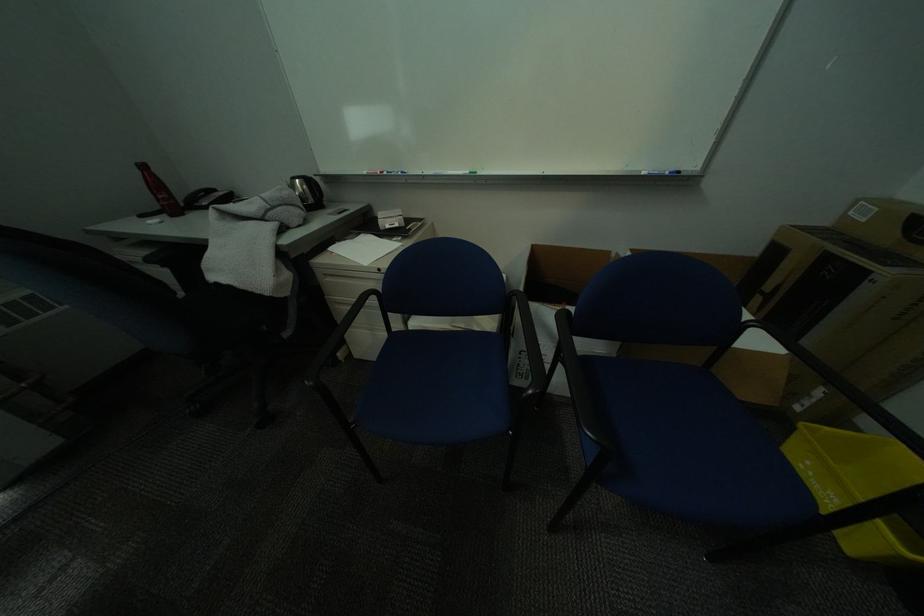
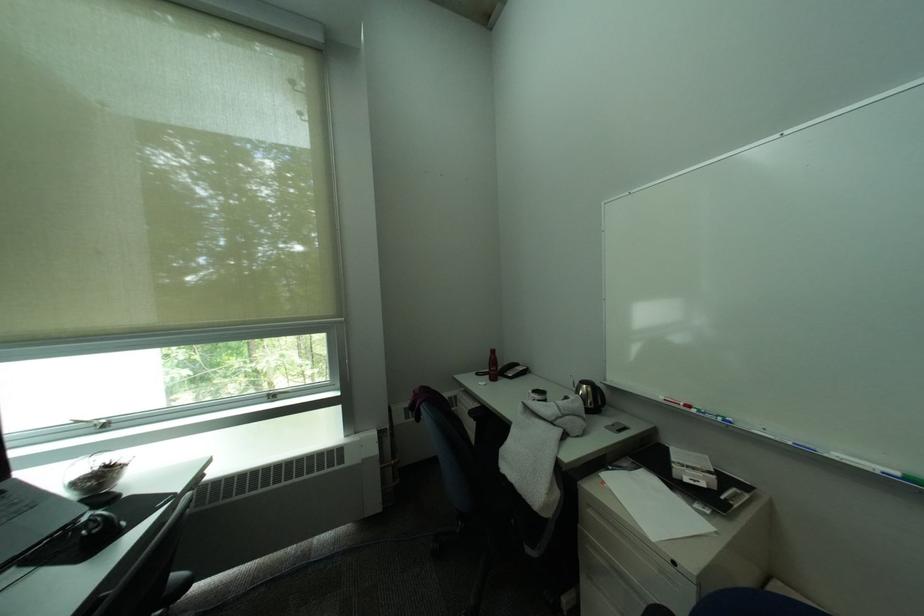
In the second image, find the point that corresponds to point (172, 198) in the first image.

(503, 370)